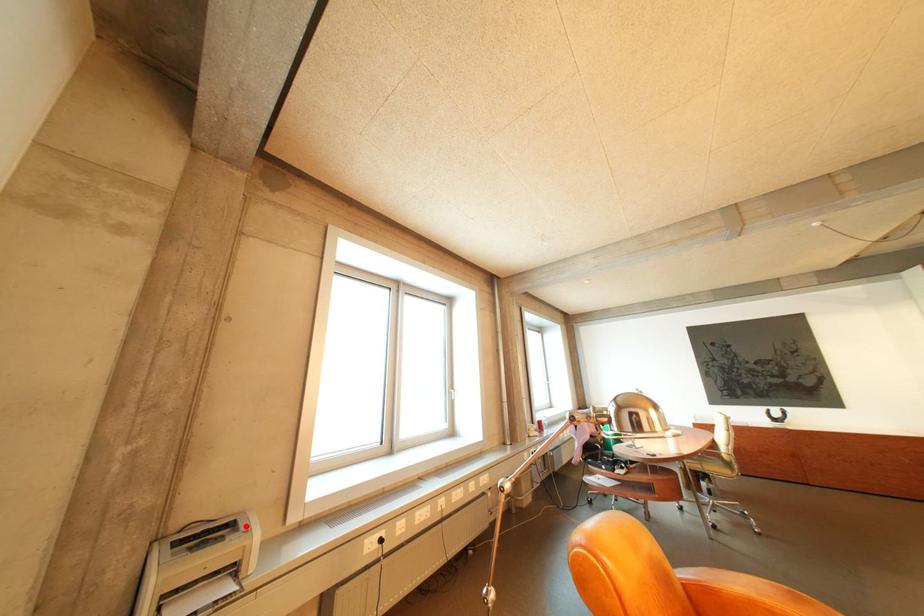
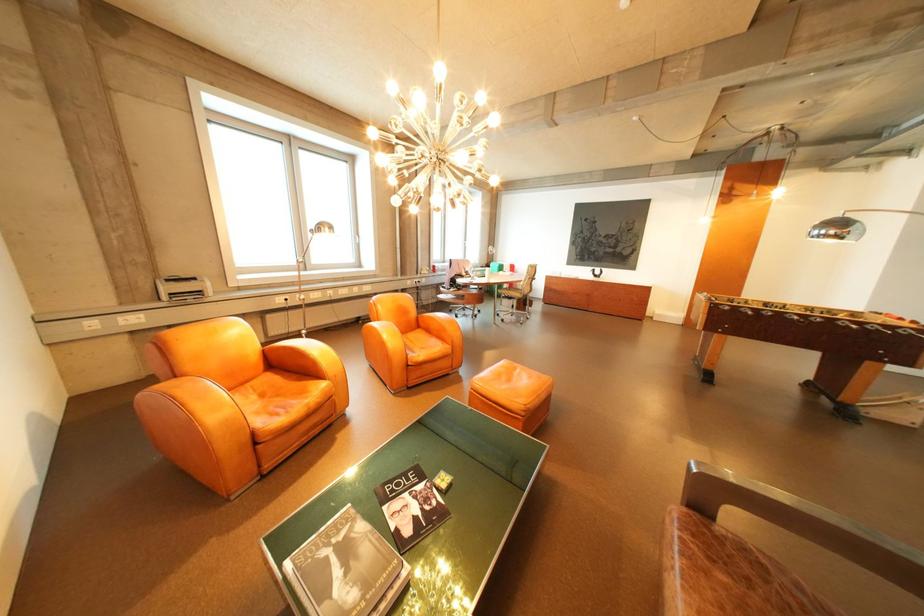
Question: A red point is marked in image1. In image2, is the corresponding 3D point closer to the camera or farther? Reply with the corresponding letter.

Choices:
 (A) The corresponding 3D point is closer.
 (B) The corresponding 3D point is farther.

Answer: (A)